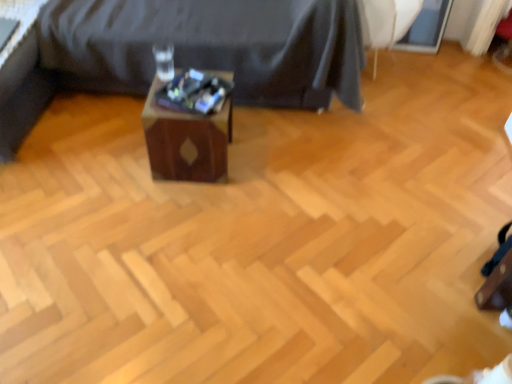
Where is `free space above wooden box at center (from a real-world perspective)`? free space above wooden box at center (from a real-world perspective) is located at coordinates (185, 96).